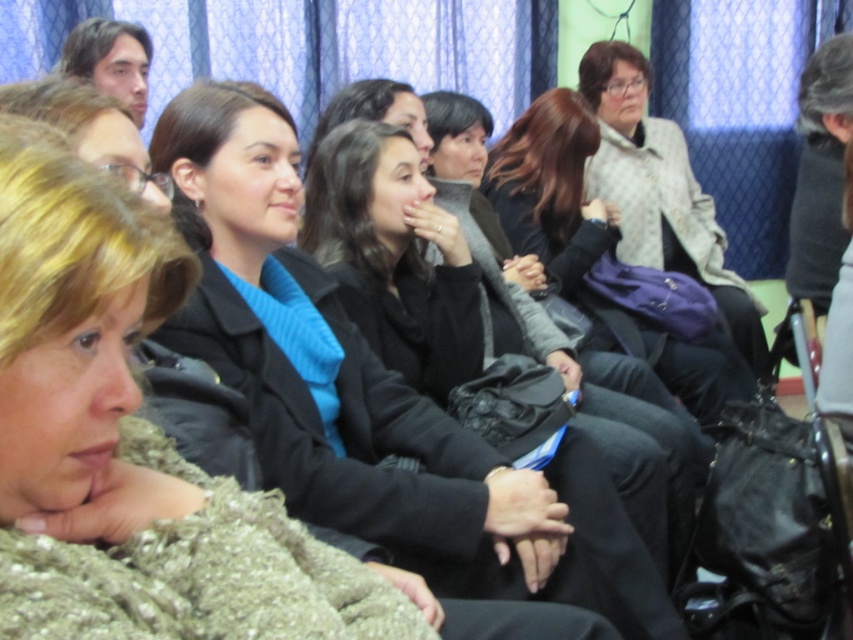
You are organizing a small conference and need to place a name tag holder between the knitted wool scarf at center and the matte black bag at center. The name tag holder requires at least 10 cm of space between the two objects. Can you determine if there is enough space?

The knitted wool scarf at center is narrower than the matte black bag at center, but the exact distance between them isn

You are sitting in the front row of a conference and see two attendees wearing a blue woolen sweater at center and a black leather jacket at center. Which one is more to the left?

The blue woolen sweater at center is more to the left than the black leather jacket at center.